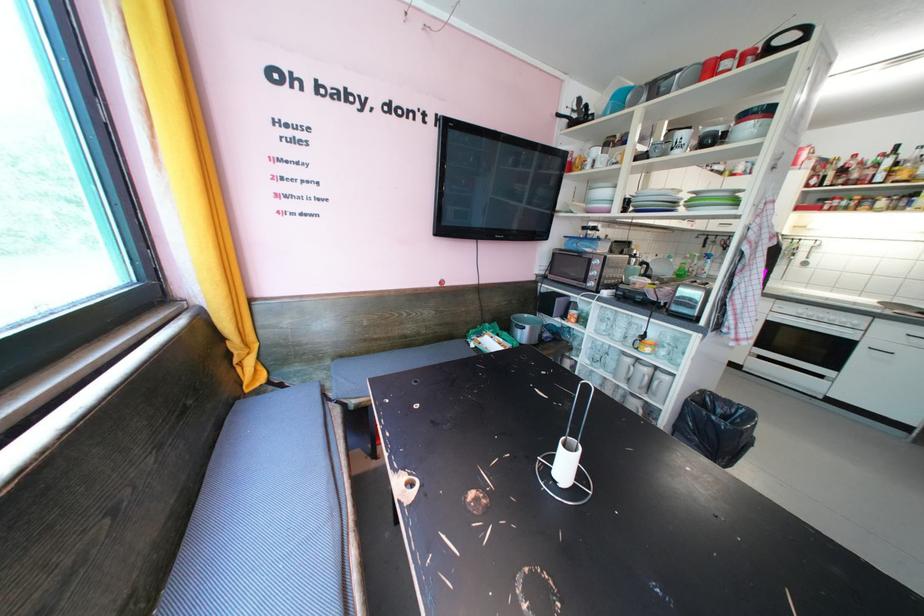
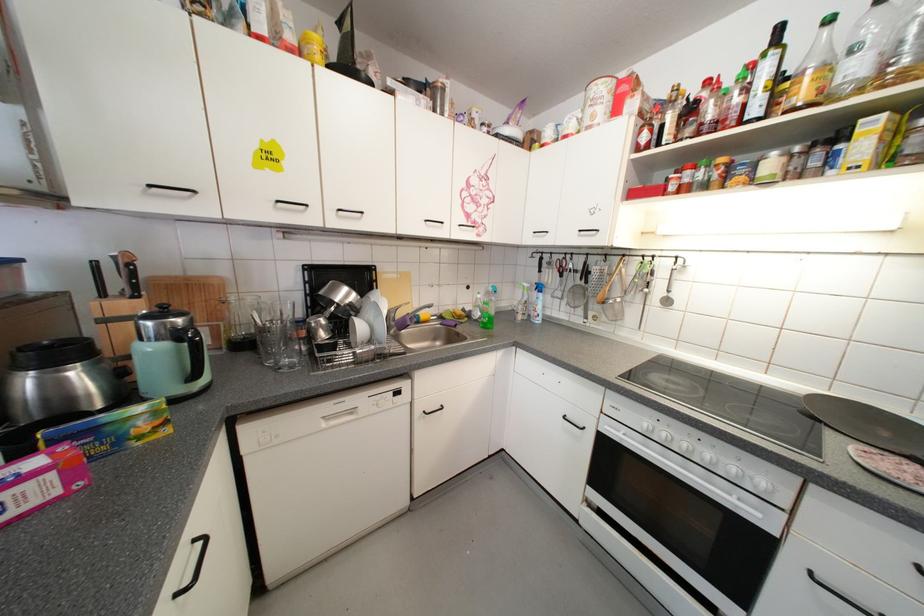
Where in the second image is the point corresponding to point (888, 180) from the first image?

(763, 111)